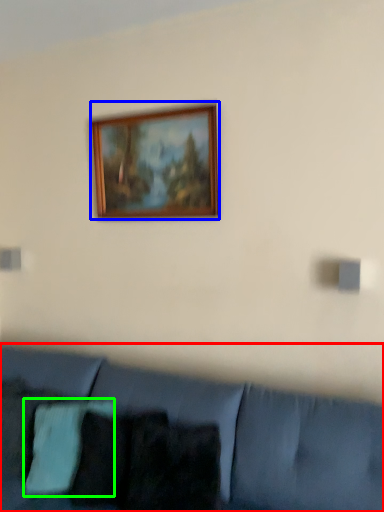
Question: Based on their relative distances, which object is farther from studio couch (highlighted by a red box)? Choose from picture frame (highlighted by a blue box) and pillow (highlighted by a green box).

Choices:
 (A) picture frame
 (B) pillow

Answer: (A)